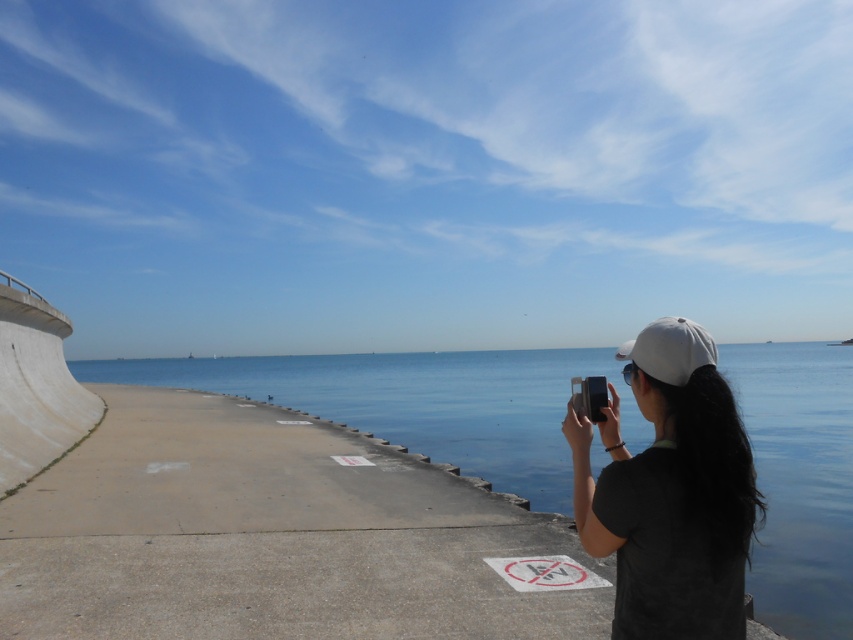
You are a photographer who wants to capture the clear blue water at center and the black matte cap at upper right in the same frame. Since you can only focus on one subject, which one will appear larger in your photo?

The clear blue water at center will appear larger in the photo because it is much taller than the black matte cap at upper right.

You are a photographer trying to capture the black matte cap at upper right in your shot. The camera you are using has a field of view that can only cover up to 0.8 units in height. Given the position of the black matte cap at upper right at point (670, 492), will the cap fit vertically within the camera frame?

The black matte cap at upper right is located at point 0.787 on the y axis. Since the camera can cover up to 0.8 units in height, the cap will fit vertically within the camera frame as its position is within the allowable range.

You are standing on the concrete walkway and want to take a photo of the clear blue water at center. Where should you position yourself relative to the black matte cap at upper right?

To take a photo of the clear blue water at center, you should position yourself to the right of the black matte cap at upper right since the clear blue water at center is located to the right of it.